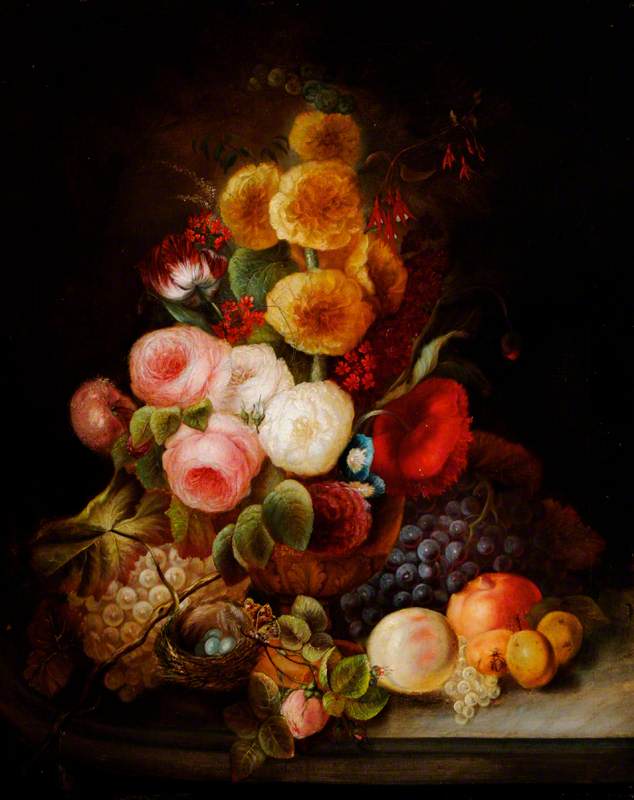
Image resolution: width=634 pixels, height=800 pixels. Identify the location of wooden table surface. [x=598, y=705].